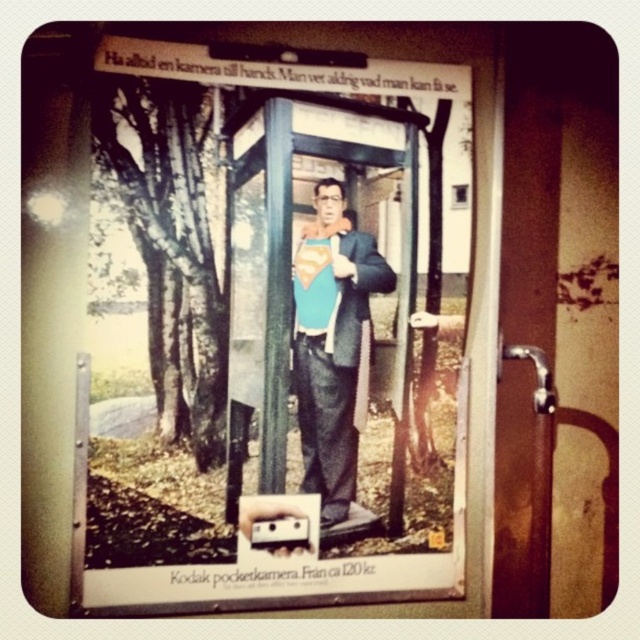
Question: Which point is farther from the camera taking this photo?

Choices:
 (A) (337, 301)
 (B) (470, 84)

Answer: (B)

Question: Is matte blue suit at center wider than blue fabric superman suit at center?

Choices:
 (A) no
 (B) yes

Answer: (B)

Question: Which object appears farthest from the camera in this image?

Choices:
 (A) matte blue suit at center
 (B) blue fabric superman suit at center

Answer: (B)

Question: Is matte blue suit at center bigger than blue fabric superman suit at center?

Choices:
 (A) no
 (B) yes

Answer: (B)

Question: Does matte blue suit at center have a greater width compared to blue fabric superman suit at center?

Choices:
 (A) yes
 (B) no

Answer: (A)

Question: Which point is closer to the camera?

Choices:
 (A) (342, 246)
 (B) (186, 122)

Answer: (B)